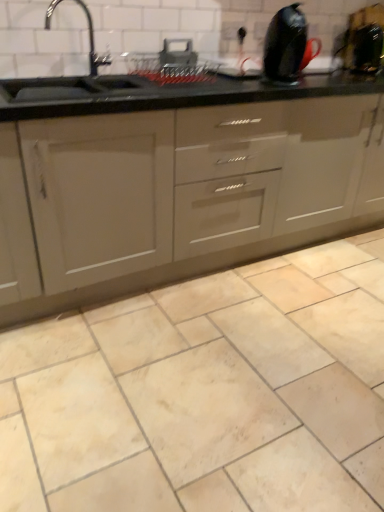
The width and height of the screenshot is (384, 512). I want to click on vacant location below glossy black kettle at upper right, positioned as the 2th appliance in right-to-left order (from a real-world perspective), so click(x=274, y=82).